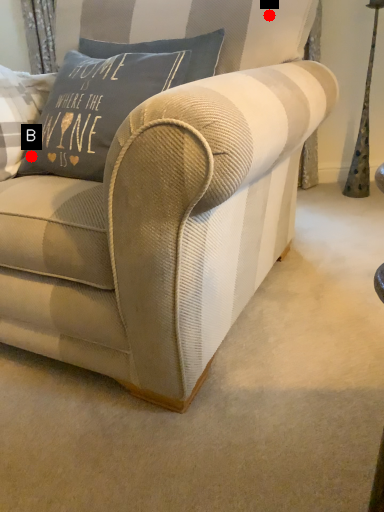
Question: Two points are circled on the image, labeled by A and B beside each circle. Which point appears farthest from the camera in this image?

Choices:
 (A) A is further
 (B) B is further

Answer: (A)